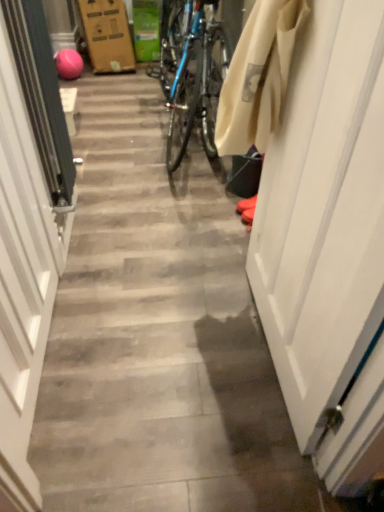
Question: Can you confirm if white matte door at right, which ranks as the 2th door in left-to-right order, is smaller than white glossy door at left, placed as the second door when sorted from right to left?

Choices:
 (A) yes
 (B) no

Answer: (A)

Question: Can you confirm if white matte door at right, the 1th door from the right, is shorter than white glossy door at left, the 1th door when ordered from left to right?

Choices:
 (A) yes
 (B) no

Answer: (B)

Question: Is white matte door at right, the 1th door from the right, at the right side of white glossy door at left, placed as the second door when sorted from right to left?

Choices:
 (A) no
 (B) yes

Answer: (B)

Question: Would you say white matte door at right, the 1th door from the right, contains white glossy door at left, the 1th door when ordered from left to right?

Choices:
 (A) no
 (B) yes

Answer: (A)

Question: Is the position of white matte door at right, the 1th door from the right, less distant than that of white glossy door at left, placed as the second door when sorted from right to left?

Choices:
 (A) no
 (B) yes

Answer: (B)

Question: From a real-world perspective, is white matte door at right, the 1th door from the right, over white glossy door at left, the 1th door when ordered from left to right?

Choices:
 (A) yes
 (B) no

Answer: (A)

Question: From the image's perspective, is white glossy door at left, the 1th door when ordered from left to right, beneath white matte door at right, which ranks as the 2th door in left-to-right order?

Choices:
 (A) yes
 (B) no

Answer: (A)

Question: Is white glossy door at left, placed as the second door when sorted from right to left, smaller than white matte door at right, which ranks as the 2th door in left-to-right order?

Choices:
 (A) no
 (B) yes

Answer: (A)

Question: Does white glossy door at left, placed as the second door when sorted from right to left, lie behind white matte door at right, which ranks as the 2th door in left-to-right order?

Choices:
 (A) yes
 (B) no

Answer: (A)

Question: Can you confirm if white glossy door at left, placed as the second door when sorted from right to left, is thinner than white matte door at right, the 1th door from the right?

Choices:
 (A) yes
 (B) no

Answer: (B)

Question: Considering the relative sizes of white glossy door at left, the 1th door when ordered from left to right, and white matte door at right, which ranks as the 2th door in left-to-right order, in the image provided, is white glossy door at left, the 1th door when ordered from left to right, bigger than white matte door at right, which ranks as the 2th door in left-to-right order,?

Choices:
 (A) yes
 (B) no

Answer: (A)

Question: Does white glossy door at left, the 1th door when ordered from left to right, have a greater height compared to white matte door at right, which ranks as the 2th door in left-to-right order?

Choices:
 (A) yes
 (B) no

Answer: (B)

Question: In terms of width, does white glossy door at left, the 1th door when ordered from left to right, look wider or thinner when compared to white matte door at right, which ranks as the 2th door in left-to-right order?

Choices:
 (A) wide
 (B) thin

Answer: (A)